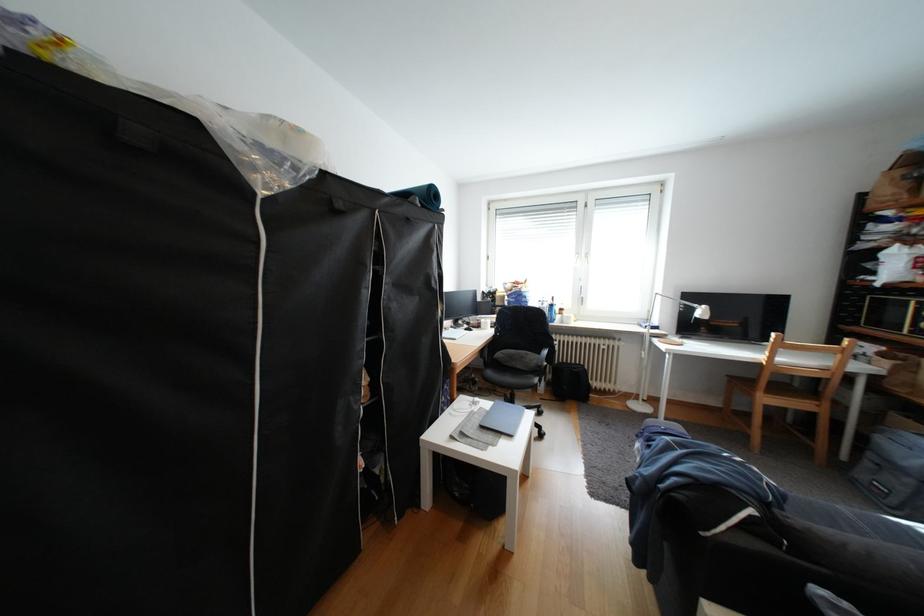
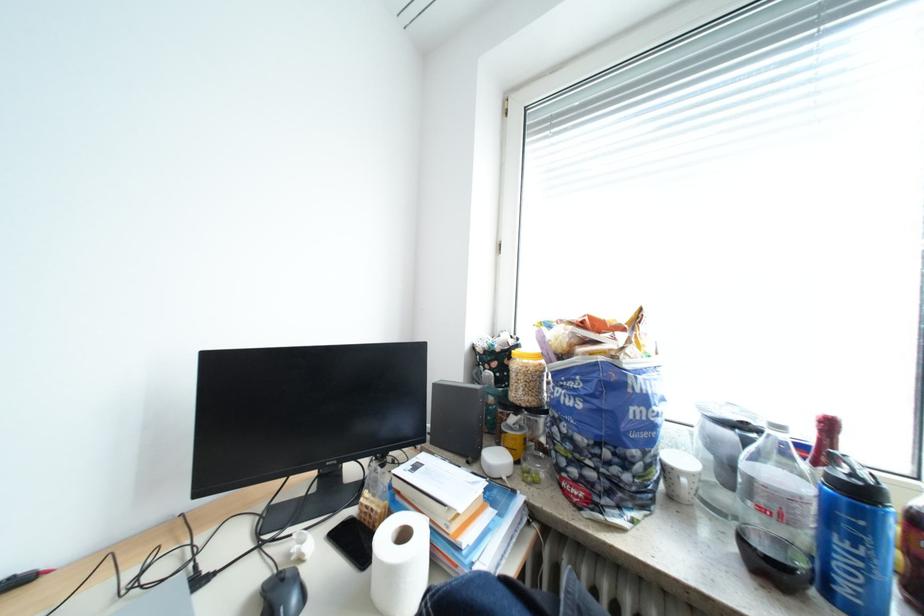
Find the pixel in the second image that matches point 511,304 in the first image.

(529, 394)